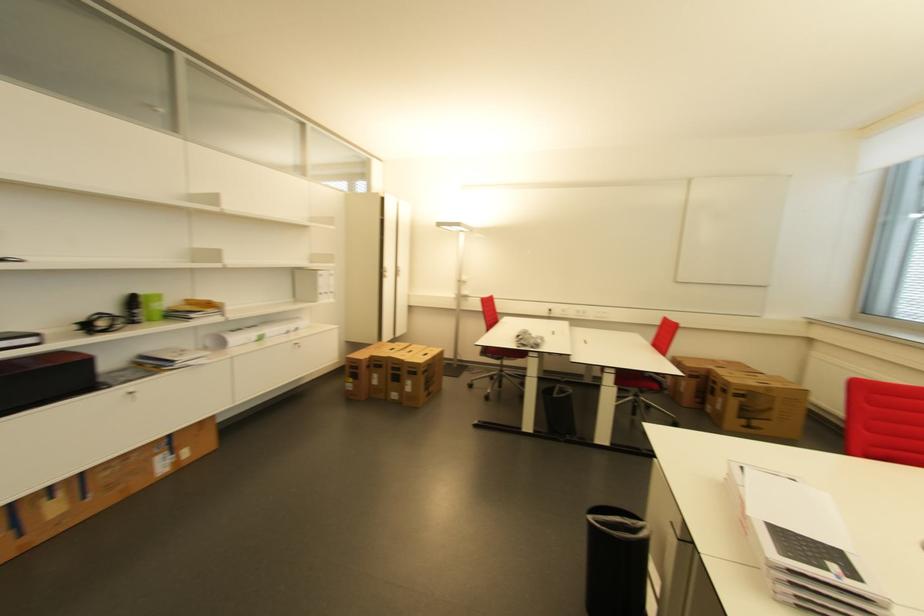
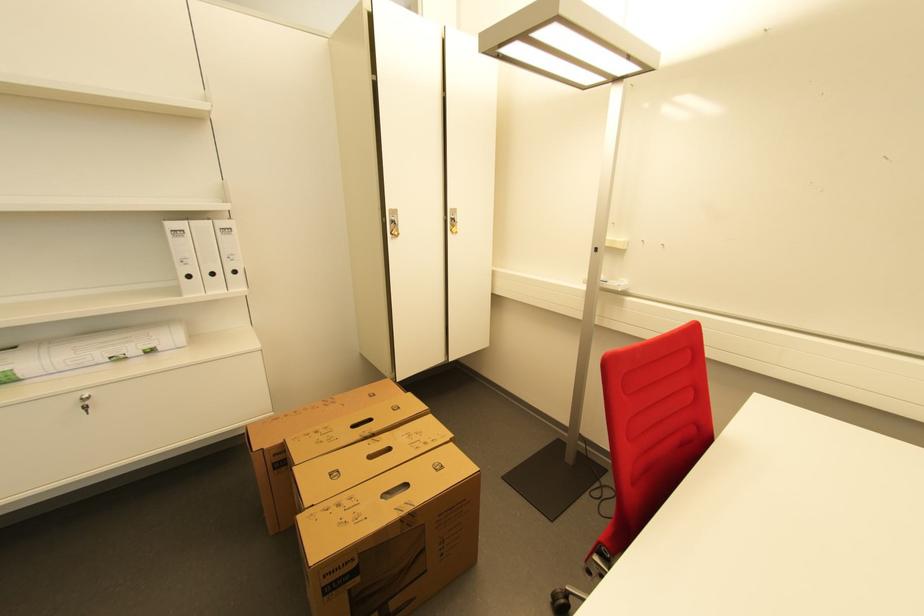
In the second image, find the point that corresponds to point 323,274 in the first image.

(176, 225)